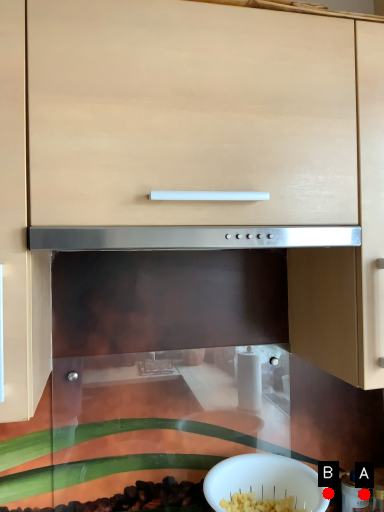
Question: Two points are circled on the image, labeled by A and B beside each circle. Which point appears closest to the camera in this image?

Choices:
 (A) A is closer
 (B) B is closer

Answer: (A)